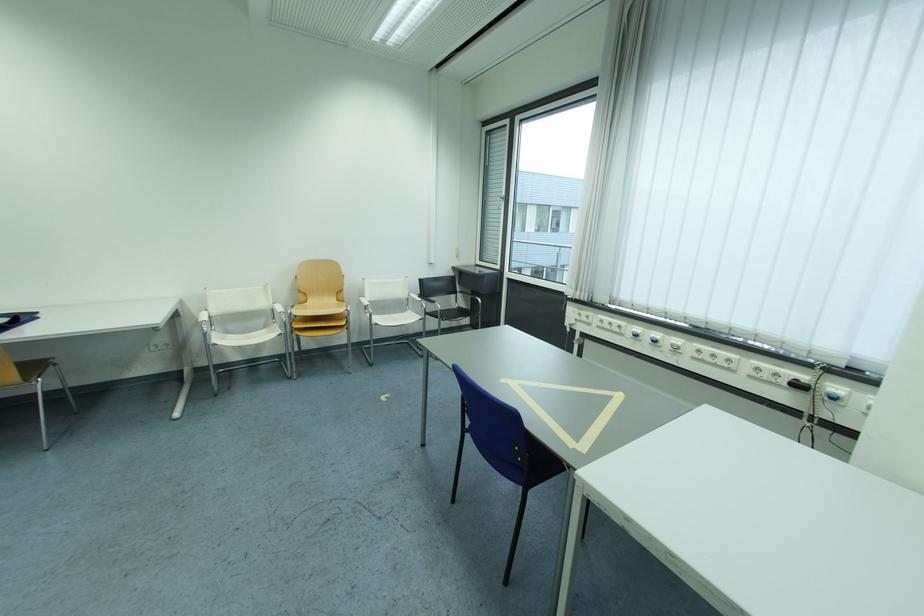
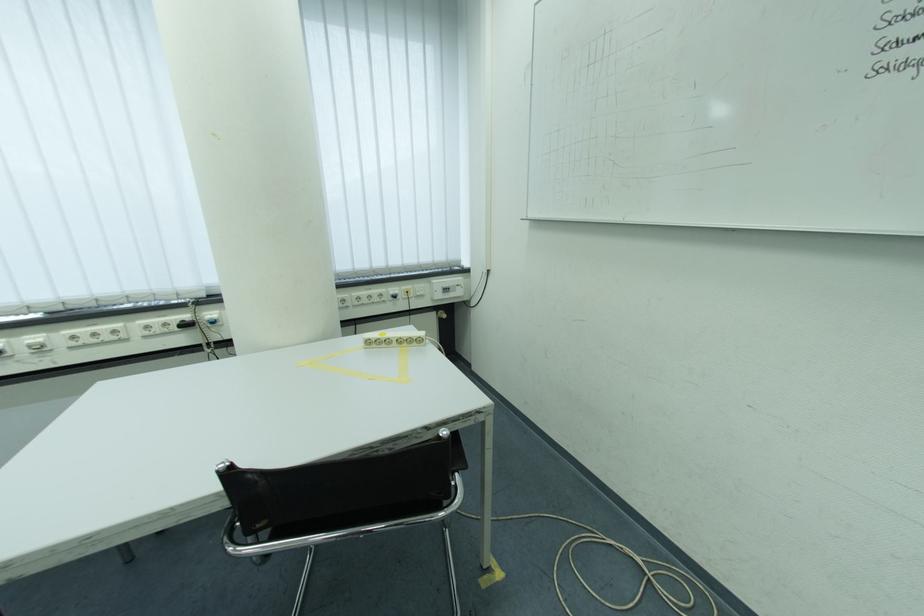
Where in the second image is the point corresponding to [845,390] from the first image?

(217, 315)